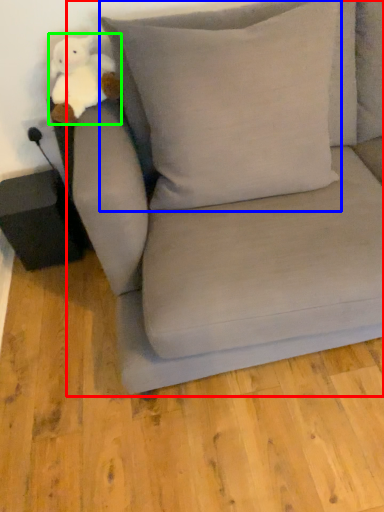
Question: Which object is the farthest from studio couch (highlighted by a red box)? Choose among these: pillow (highlighted by a blue box) or toy (highlighted by a green box).

Choices:
 (A) pillow
 (B) toy

Answer: (B)